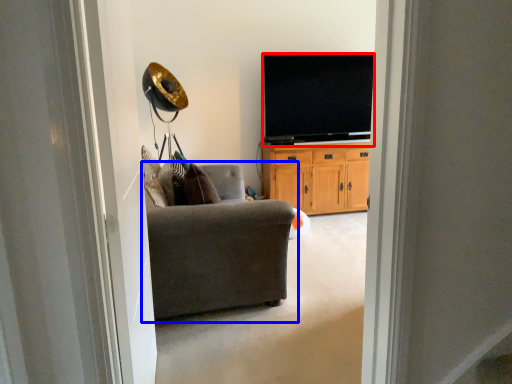
Question: Which point is closer to the camera, television (highlighted by a red box) or chair (highlighted by a blue box)?

Choices:
 (A) television
 (B) chair

Answer: (B)